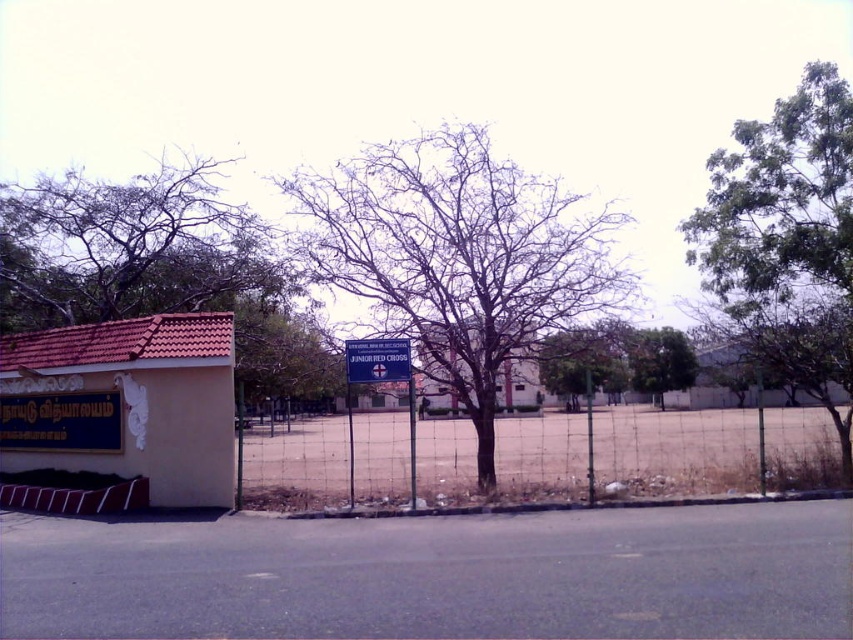
You are a pedestrian standing on the paved road in the foreground. You want to walk towards the building with the signboard. Which tree should you pass first, the brown textured tree at left or the green leafy tree at upper right?

The brown textured tree at left is positioned on the left side of the green leafy tree at upper right, so you will pass the brown textured tree at left first before reaching the green leafy tree at upper right.

You are a pedestrian standing on the paved road and want to read both the yellow matte sign at lower left and the blue plastic sign at center. Which sign has a larger width?

The yellow matte sign at lower left has a larger width than the blue plastic sign at center according to the description.